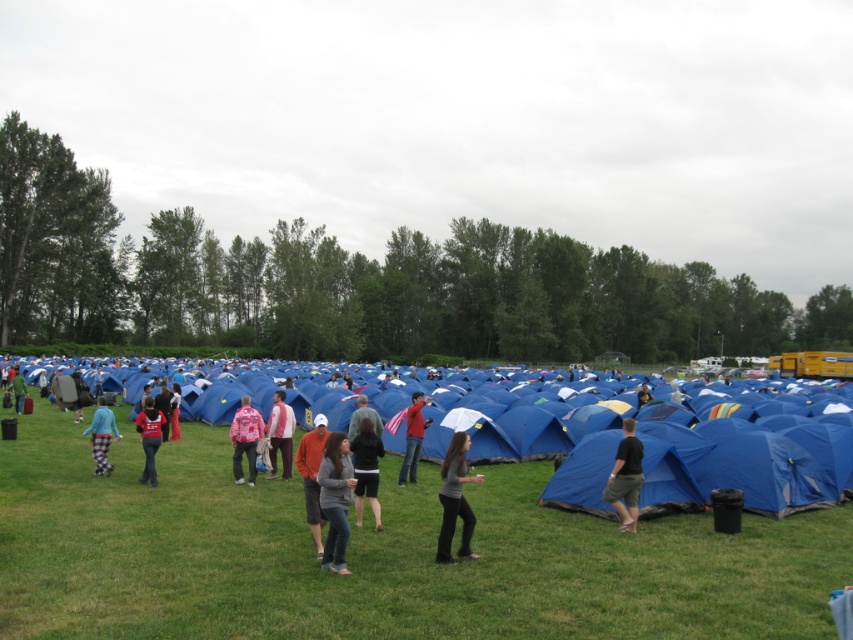
Question: Is matte red shirt at center to the right of green fabric jacket at center from the viewer's perspective?

Choices:
 (A) yes
 (B) no

Answer: (A)

Question: Which of the following is the farthest from the observer?

Choices:
 (A) matte red jacket at center
 (B) matte pink hoodie at center
 (C) gray sweater at center

Answer: (B)

Question: Does green grass at center have a larger size compared to matte red shirt at center?

Choices:
 (A) yes
 (B) no

Answer: (A)

Question: Which of these objects is positioned closest to the green grass at center?

Choices:
 (A) matte gray hoodie at center
 (B) matte red jacket at center
 (C) gray sweater at center

Answer: (A)

Question: Among these objects, which one is farthest from the camera?

Choices:
 (A) dark gray fabric pants at center
 (B) green grass at center

Answer: (A)

Question: Is black cotton shorts at center to the right of matte gray hoodie at center from the viewer's perspective?

Choices:
 (A) no
 (B) yes

Answer: (B)